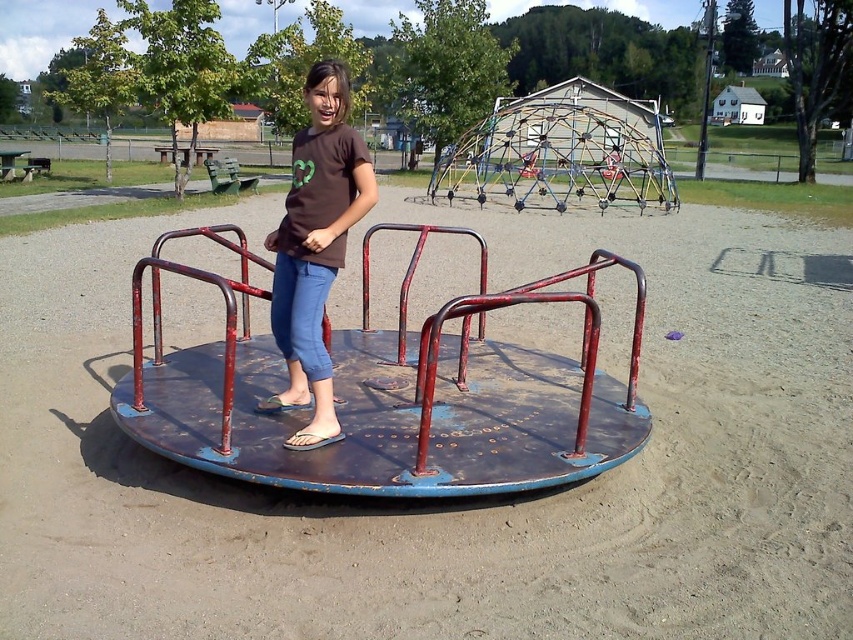
You are a photographer trying to capture the rusty metal carousel at center and the brown matte shirt at center in the same frame. Based on their positions, will the carousel block the view of the shirt?

The rusty metal carousel at center is in front of the brown matte shirt at center, so the carousel will block the view of the shirt.

You are a photographer standing at the point with coordinates point (390, 392). You want to take a photo of the rusty metal carousel at center. Since you are already at the point, can you directly take the photo without moving?

The point (390, 392) indicates the location of the rusty metal carousel at center, so yes, you can directly take the photo without moving since you are already at the correct position.

From the picture: You are standing at the playground and want to know which of the two points, point (241, 253) or point (299, 220), is closer to you. Can you determine this based on their positions?

Point (299, 220) is closer to you because it is less further to the camera than point (241, 253).